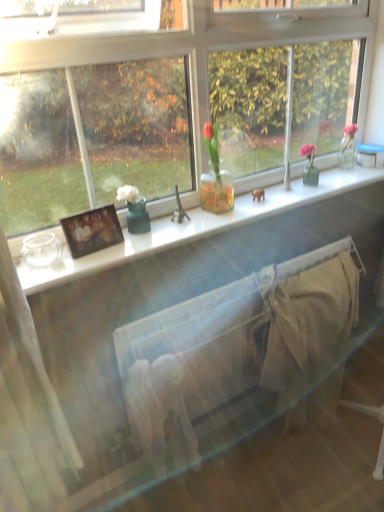
Question: Considering the relative sizes of beige cotton blanket at lower right and white fabric bed frame at center in the image provided, is beige cotton blanket at lower right shorter than white fabric bed frame at center?

Choices:
 (A) yes
 (B) no

Answer: (B)

Question: Can you confirm if beige cotton blanket at lower right is smaller than white fabric bed frame at center?

Choices:
 (A) yes
 (B) no

Answer: (B)

Question: Is beige cotton blanket at lower right bigger than white fabric bed frame at center?

Choices:
 (A) yes
 (B) no

Answer: (A)

Question: From a real-world perspective, is beige cotton blanket at lower right located higher than white fabric bed frame at center?

Choices:
 (A) no
 (B) yes

Answer: (A)

Question: From a real-world perspective, is beige cotton blanket at lower right positioned under white fabric bed frame at center based on gravity?

Choices:
 (A) yes
 (B) no

Answer: (A)

Question: Is beige cotton blanket at lower right far away from white fabric bed frame at center?

Choices:
 (A) yes
 (B) no

Answer: (B)

Question: Considering the relative sizes of white glossy window sill at center and matte wooden picture frame at left in the image provided, is white glossy window sill at center bigger than matte wooden picture frame at left?

Choices:
 (A) no
 (B) yes

Answer: (B)

Question: Is white glossy window sill at center at the left side of matte wooden picture frame at left?

Choices:
 (A) no
 (B) yes

Answer: (A)

Question: Can you confirm if white glossy window sill at center is wider than matte wooden picture frame at left?

Choices:
 (A) yes
 (B) no

Answer: (A)

Question: Is the depth of white glossy window sill at center greater than that of matte wooden picture frame at left?

Choices:
 (A) yes
 (B) no

Answer: (B)

Question: Considering the relative sizes of white glossy window sill at center and matte wooden picture frame at left in the image provided, is white glossy window sill at center taller than matte wooden picture frame at left?

Choices:
 (A) no
 (B) yes

Answer: (A)

Question: Is white glossy window sill at center outside matte wooden picture frame at left?

Choices:
 (A) yes
 (B) no

Answer: (A)

Question: Is white glossy window sill at center positioned before white fabric bed frame at center?

Choices:
 (A) no
 (B) yes

Answer: (B)